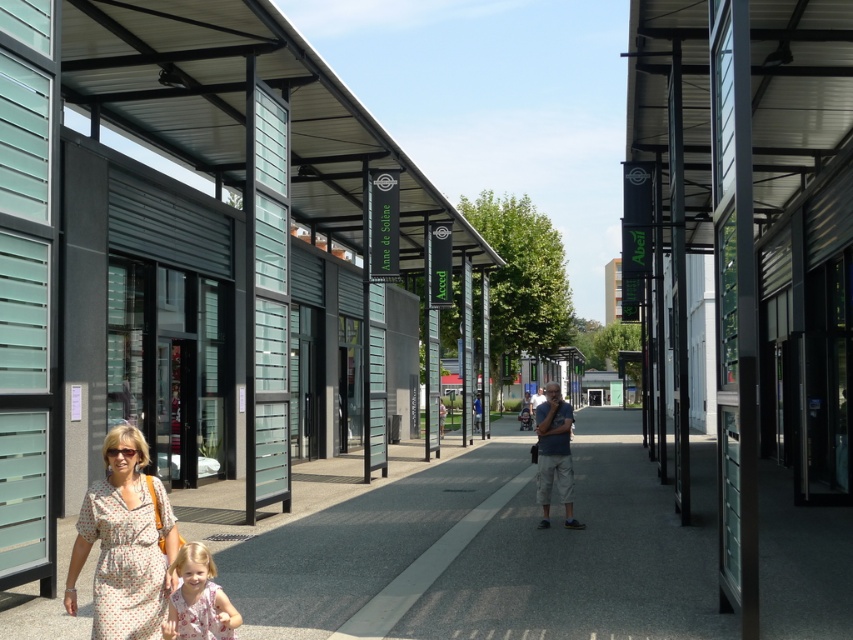
Who is positioned more to the right, smooth concrete pavement at lower center or floral dress at lower left?

Positioned to the right is smooth concrete pavement at lower center.

What do you see at coordinates (474, 545) in the screenshot? This screenshot has width=853, height=640. I see `smooth concrete pavement at lower center` at bounding box center [474, 545].

Who is more forward, (595, 536) or (201, 637)?

Point (201, 637) is in front.

Image resolution: width=853 pixels, height=640 pixels. I want to click on smooth concrete pavement at lower center, so [474, 545].

Is dotted fabric dress at lower left wider than floral dress at lower left?

Yes, dotted fabric dress at lower left is wider than floral dress at lower left.

This screenshot has width=853, height=640. I want to click on dotted fabric dress at lower left, so coord(123,544).

Measure the distance from smooth concrete pavement at lower center to matte gray shorts at center.

smooth concrete pavement at lower center is 4.68 meters away from matte gray shorts at center.

Does smooth concrete pavement at lower center appear under matte gray shorts at center?

Yes, smooth concrete pavement at lower center is below matte gray shorts at center.

Is point (534, 589) closer to camera compared to point (544, 412)?

Yes.

Locate an element on the screen. The height and width of the screenshot is (640, 853). smooth concrete pavement at lower center is located at coordinates (474, 545).